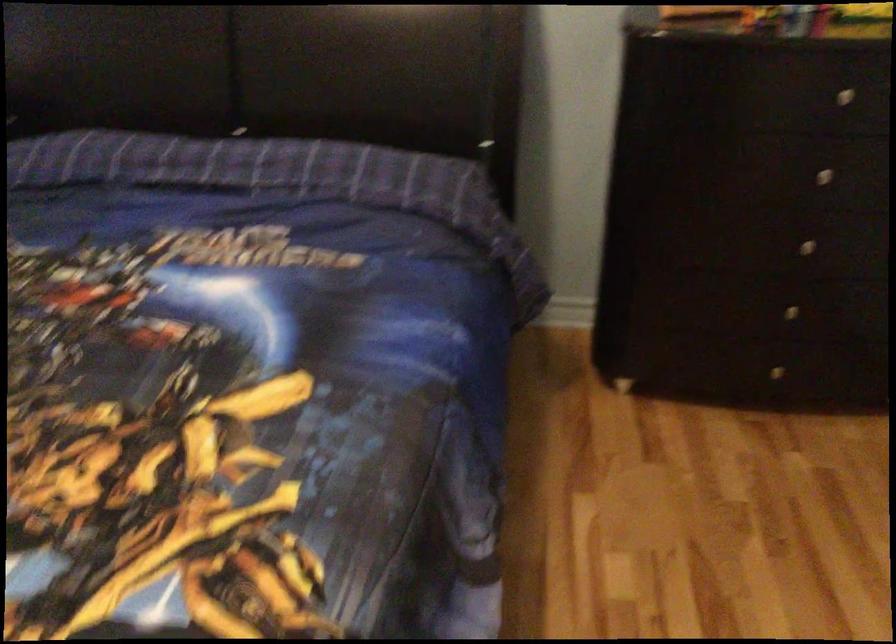
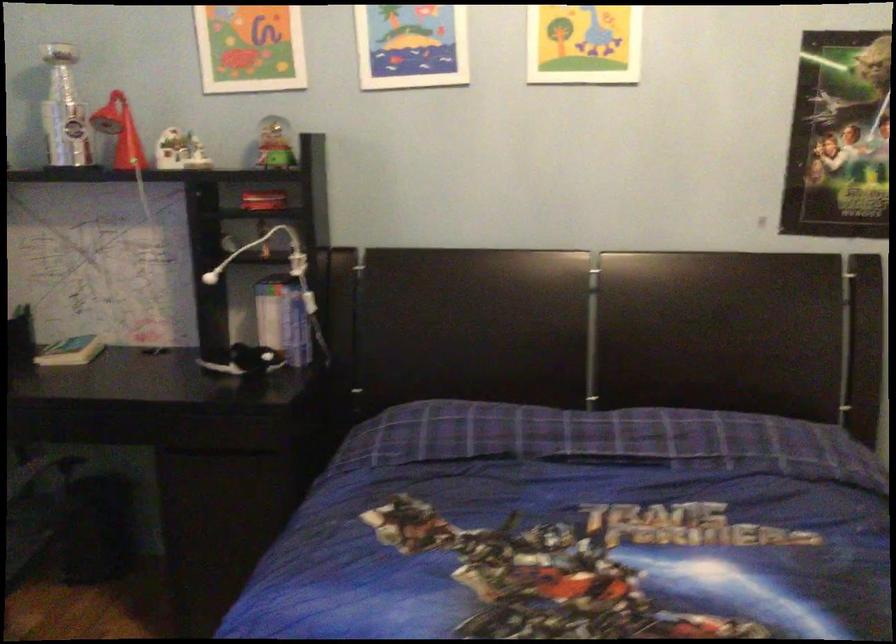
Question: The images are taken continuously from a first-person perspective. In which direction are you moving?

Choices:
 (A) Left
 (B) Right
 (C) Forward
 (D) Backward

Answer: (A)